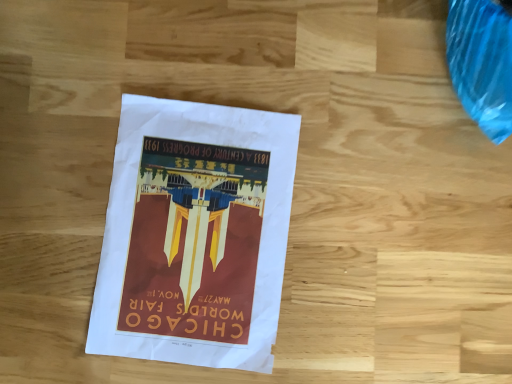
This screenshot has width=512, height=384. What are the coordinates of `matte paper poster at center` in the screenshot? It's located at (195, 234).

The height and width of the screenshot is (384, 512). What do you see at coordinates (195, 234) in the screenshot?
I see `matte paper poster at center` at bounding box center [195, 234].

You are a GUI agent. You are given a task and a screenshot of the screen. Output one action in this format:
    pyautogui.click(x=<x>, y=<y>)
    Task: Click on the matte paper poster at center
    
    Given the screenshot: What is the action you would take?
    pyautogui.click(x=195, y=234)